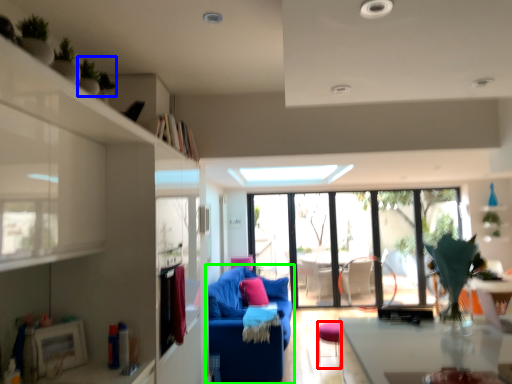
Question: Considering the real-world distances, which object is closest to stool (highlighted by a red box)? plant (highlighted by a blue box) or studio couch (highlighted by a green box).

Choices:
 (A) plant
 (B) studio couch

Answer: (B)